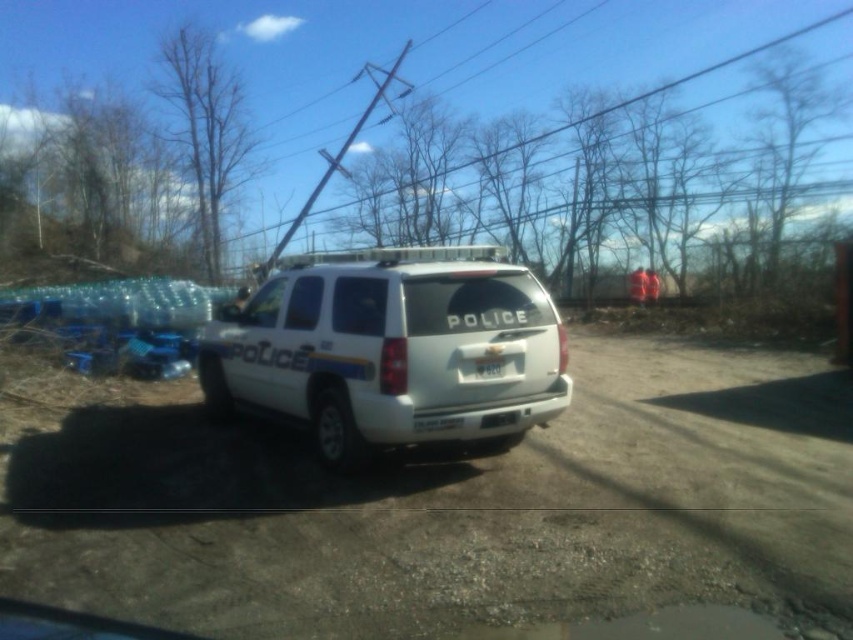
In the scene shown: You are a photographer trying to capture the white matte police suv at center and the white plastic license plate at center in a single frame. Since the suv is larger, will you need to adjust your camera angle to focus on both objects equally?

The white matte police suv at center is larger than the white plastic license plate at center, so you will need to adjust your camera angle to ensure both are focused equally in the frame.

You are standing at the point marked by the coordinates point (454, 509) in the image. Looking around, you see a white police SUV parked on a dirt road. Where is the white police SUV located relative to your current position?

The white police SUV is parked on the white gravel dirt track at center, which is the location marked by the point (454, 509). Therefore, the white police SUV is right where you are standing.

You are a delivery driver who needs to park your truck on the white gravel dirt track at center. However, you must ensure that your truck does not block the white plastic license plate at center. Given that your truck is 4 meters long, can you safely park your truck on the track without overlapping the license plate?

The white gravel dirt track at center and white plastic license plate at center are 2.31 meters apart. Since the truck is 4 meters long, which is longer than the distance between them, parking the truck on the track would cause it to overlap the license plate. Therefore, you cannot safely park the truck without blocking the license plate.